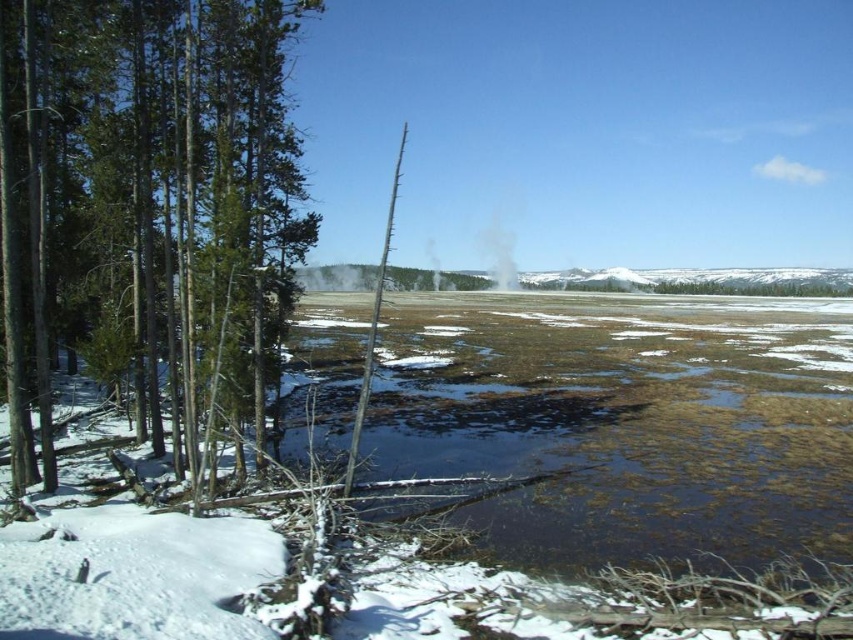
Does brown murky water at center have a smaller size compared to white translucent steam at center?

Actually, brown murky water at center might be larger than white translucent steam at center.

The image size is (853, 640). I want to click on brown murky water at center, so click(x=624, y=420).

Is point (842, 522) in front of point (97, 336)?

Yes, point (842, 522) is closer to viewer.

Can you confirm if brown murky water at center is wider than green matte tree at left?

Correct, the width of brown murky water at center exceeds that of green matte tree at left.

The image size is (853, 640). I want to click on brown murky water at center, so click(x=624, y=420).

Between green matte tree at left and white translucent steam at center, which one is positioned lower?

green matte tree at left

Can you confirm if green matte tree at left is positioned to the left of white translucent steam at center?

Indeed, green matte tree at left is positioned on the left side of white translucent steam at center.

This screenshot has width=853, height=640. I want to click on green matte tree at left, so 148,211.

At what (x,y) coordinates should I click in order to perform the action: click on green matte tree at left. Please return your answer as a coordinate pair (x, y). The image size is (853, 640). Looking at the image, I should click on (148, 211).